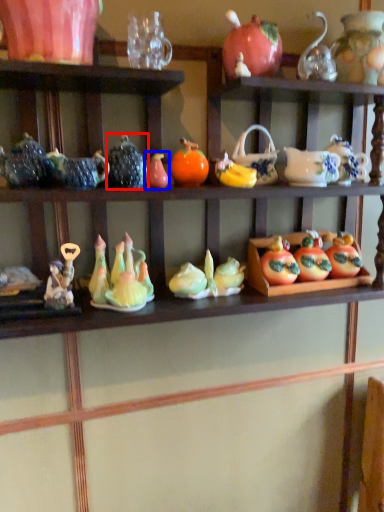
Question: Which point is closer to the camera, tableware (highlighted by a red box) or toy (highlighted by a blue box)?

Choices:
 (A) tableware
 (B) toy

Answer: (A)